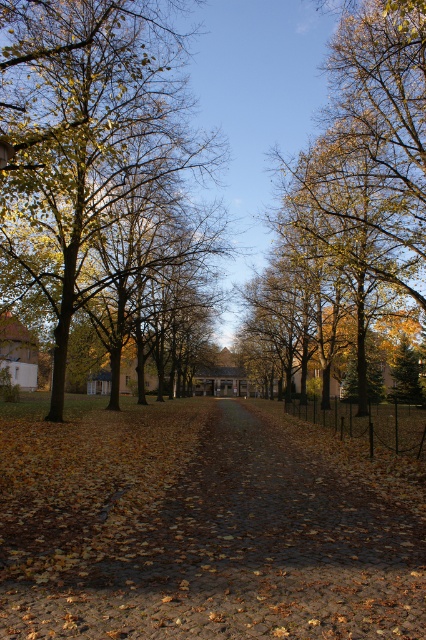
This screenshot has width=426, height=640. What do you see at coordinates (203, 525) in the screenshot? I see `brown cobblestone path at center` at bounding box center [203, 525].

Between brown cobblestone path at center and golden yellow leaves at center, which one appears on the right side from the viewer's perspective?

golden yellow leaves at center is more to the right.

Who is more forward, [302,504] or [397,106]?

Point [302,504]

Locate an element on the screen. Image resolution: width=426 pixels, height=640 pixels. brown cobblestone path at center is located at coordinates (203, 525).

Who is taller, brown cobblestone path at center or yellow-green foliage at center?

Standing taller between the two is yellow-green foliage at center.

Can you confirm if brown cobblestone path at center is shorter than yellow-green foliage at center?

Yes.

Locate an element on the screen. This screenshot has height=640, width=426. brown cobblestone path at center is located at coordinates (203, 525).

Does yellow-green foliage at center come in front of golden yellow leaves at center?

Yes, it is.

Is yellow-green foliage at center smaller than golden yellow leaves at center?

Actually, yellow-green foliage at center might be larger than golden yellow leaves at center.

Is point (109, 202) closer to viewer compared to point (420, 51)?

No, (109, 202) is further to viewer.

Image resolution: width=426 pixels, height=640 pixels. I want to click on yellow-green foliage at center, so 83,141.